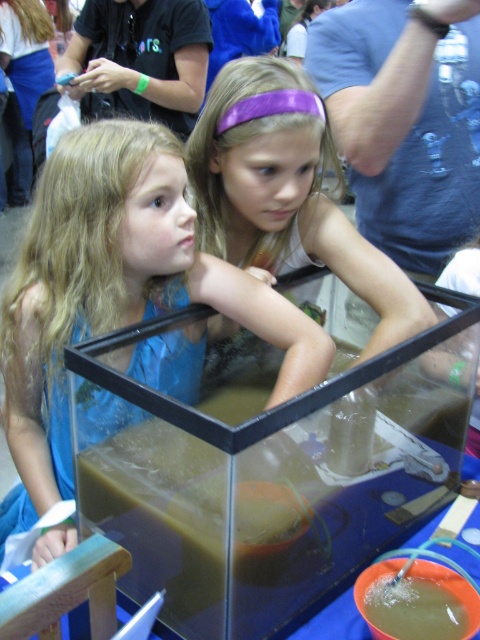
You are standing in front of the scene and need to place a small note on the table near the transparent glass tank at center. Based on the coordinates provided, where should you place the note relative to the tank?

The transparent glass tank at center is located at point (268,474), so you should place the note near those coordinates on the table.

Based on the photo, you are a photographer trying to capture a clear shot of the transparent glass tank at center and the blue fabric dress at left. Which object should you focus on first if you want to ensure both are in the frame without moving the camera?

The transparent glass tank at center should be focused on first because it occupies less space than the blue fabric dress at left, so capturing it first ensures it remains centered while adjusting for the larger dress area.

Looking at this image, you are a photographer trying to capture a closeup of the tank while ensuring both the blue fabric dress at left and the purple shiny headband at upper center are visible in the frame. Which object should you focus on to include both in the shot?

The blue fabric dress at left is larger than the purple shiny headband at upper center, so focusing on the blue fabric dress at left would ensure both are visible in the frame since it occupies more space.